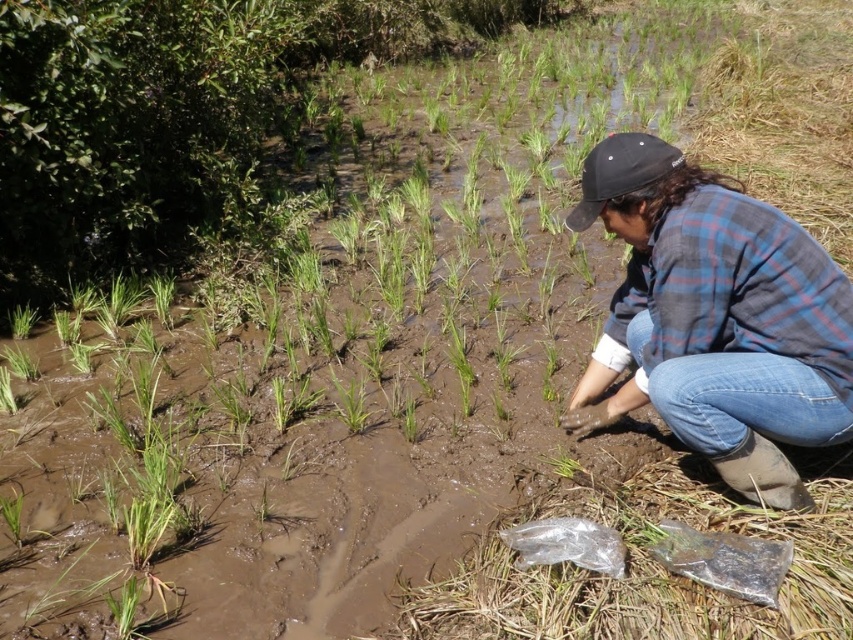
Question: Which of the following is the closest to the observer?

Choices:
 (A) (364, 412)
 (B) (808, 397)

Answer: (B)

Question: Where is blue plaid shirt at center right located in relation to green grass at center in the image?

Choices:
 (A) right
 (B) left

Answer: (A)

Question: Can you confirm if blue plaid shirt at center right is thinner than green grass at center?

Choices:
 (A) no
 (B) yes

Answer: (A)

Question: Which object is closer to the camera taking this photo?

Choices:
 (A) blue plaid shirt at center right
 (B) green grass at center

Answer: (A)

Question: Is blue plaid shirt at center right thinner than green grass at center?

Choices:
 (A) no
 (B) yes

Answer: (A)